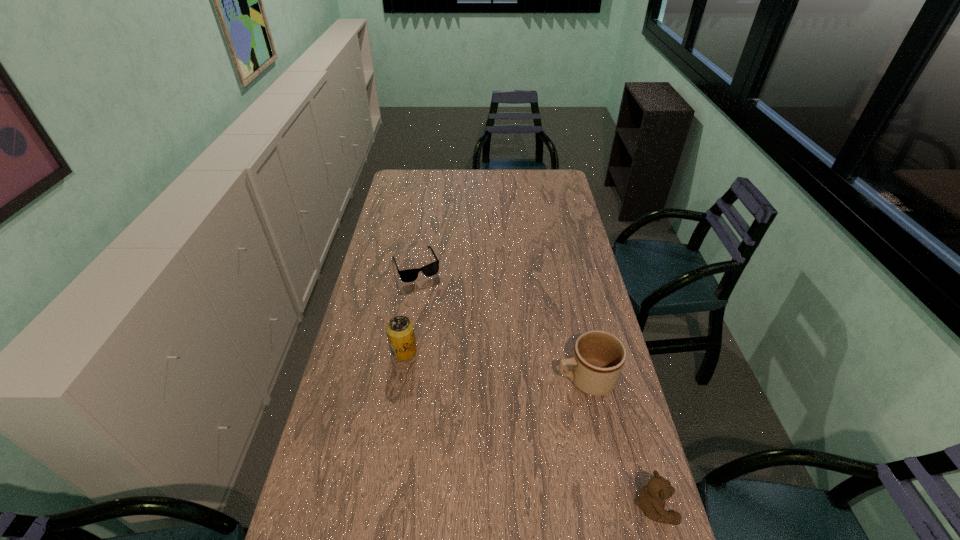
Where is `vacant spot on the desktop that is between the beer can and the teddy bear and is positioned on the side of the mug with the handle`? Image resolution: width=960 pixels, height=540 pixels. vacant spot on the desktop that is between the beer can and the teddy bear and is positioned on the side of the mug with the handle is located at coordinates (482, 400).

The image size is (960, 540). In order to click on free space on the desktop that is between the beer can and the nearest object and is positioned on the front-facing side of the shortest object in this screenshot , I will do `click(485, 401)`.